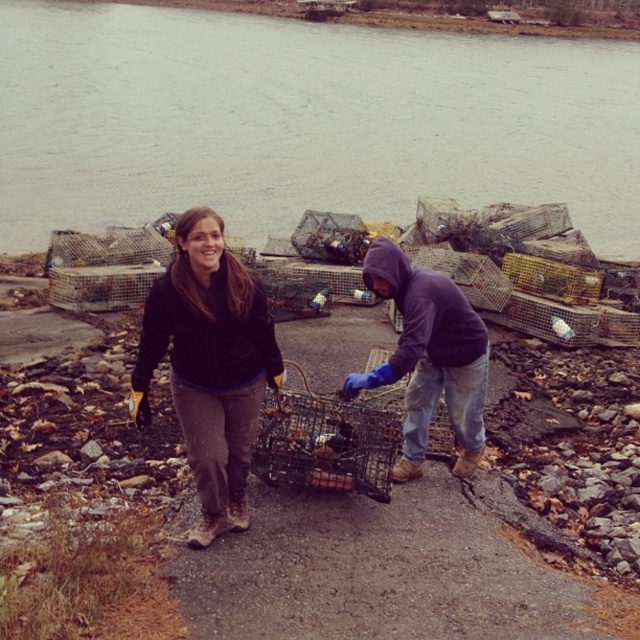
Question: Does black fleece jacket at center have a larger size compared to matte blue gloves at center?

Choices:
 (A) no
 (B) yes

Answer: (A)

Question: Which of the following is the closest to the observer?

Choices:
 (A) click(x=65, y=65)
 (B) click(x=220, y=497)
 (C) click(x=385, y=289)

Answer: (B)

Question: From the image, what is the correct spatial relationship of gray water at upper center in relation to matte blue gloves at center?

Choices:
 (A) above
 (B) below

Answer: (A)

Question: Is gray water at upper center smaller than black fleece jacket at center?

Choices:
 (A) yes
 (B) no

Answer: (B)

Question: Among these points, which one is farthest from the camera?

Choices:
 (A) (346, 388)
 (B) (205, 508)

Answer: (A)

Question: Which of the following is the closest to the observer?

Choices:
 (A) (403, 465)
 (B) (168, 292)

Answer: (B)